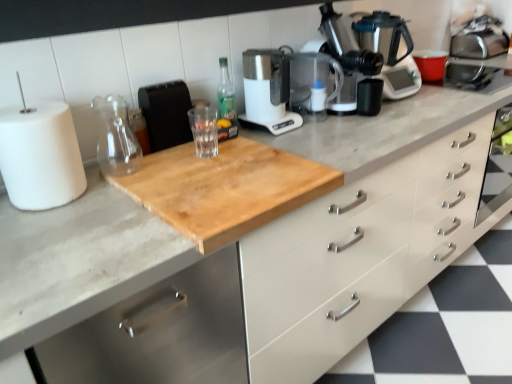
Locate an element on the screen. This screenshot has width=512, height=384. free spot to the right of transparent glass at center, the first glass jar from the right is located at coordinates (266, 150).